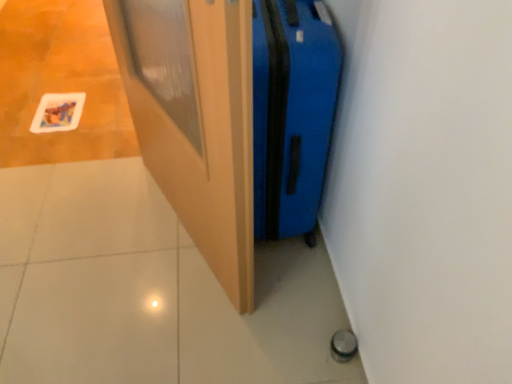
Where is `vacant area that is in front of blue hardshell suitcase at center-right`? The image size is (512, 384). vacant area that is in front of blue hardshell suitcase at center-right is located at coordinates (270, 300).